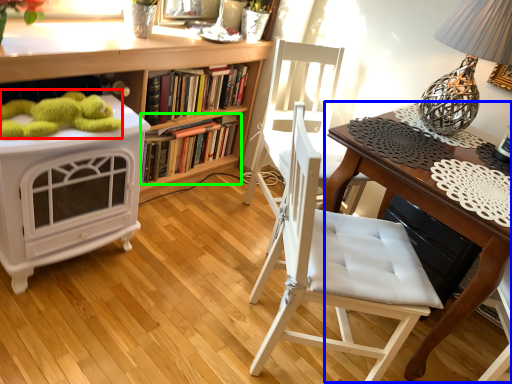
Question: Which object is the farthest from toy (highlighted by a red box)? Choose among these: table (highlighted by a blue box) or book (highlighted by a green box).

Choices:
 (A) table
 (B) book

Answer: (A)